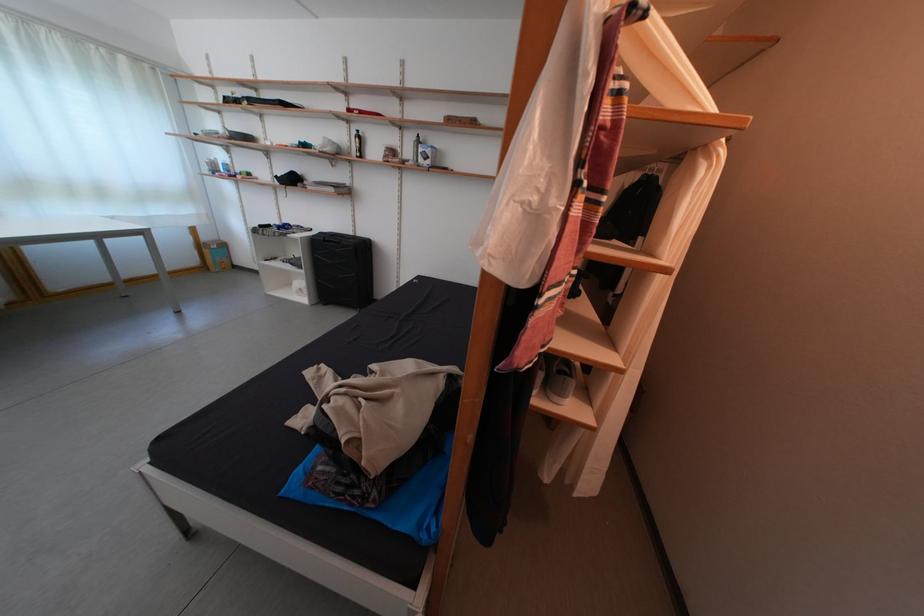
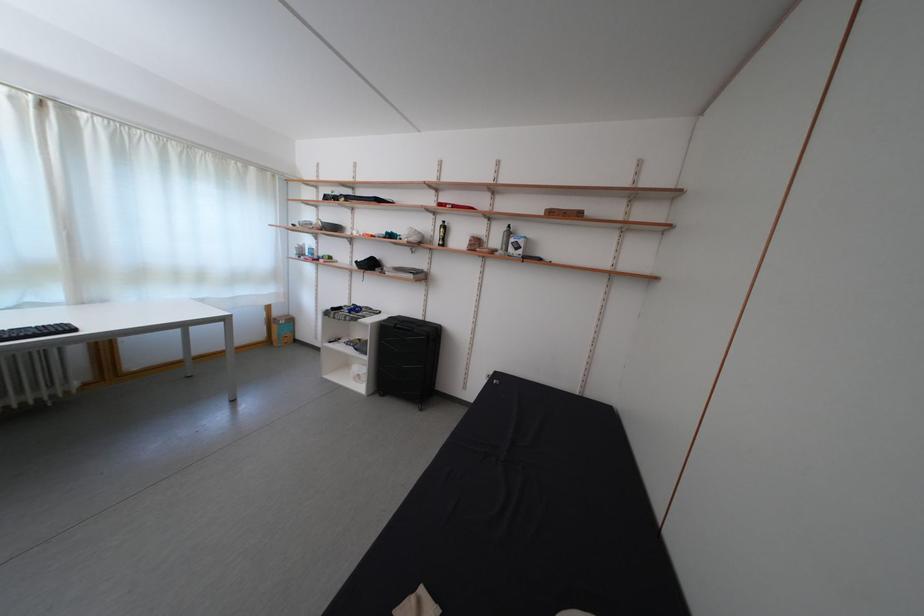
Question: How did the camera likely rotate?

Choices:
 (A) Left
 (B) Right
 (C) Up
 (D) Down

Answer: (C)